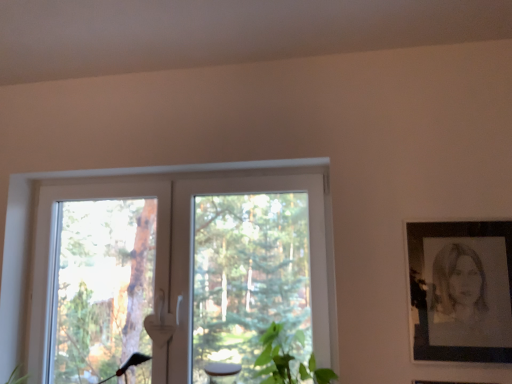
What do you see at coordinates (184, 256) in the screenshot? I see `white plastic window at center` at bounding box center [184, 256].

Image resolution: width=512 pixels, height=384 pixels. What do you see at coordinates (461, 290) in the screenshot? I see `black paper portrait at right` at bounding box center [461, 290].

Locate an element on the screen. The image size is (512, 384). white plastic window at center is located at coordinates (184, 256).

From the image's perspective, does black paper portrait at right appear lower than white plastic window at center?

No.

From a real-world perspective, is black paper portrait at right physically above white plastic window at center?

No, from a real-world perspective, black paper portrait at right is not above white plastic window at center.

Can you see black paper portrait at right touching white plastic window at center?

black paper portrait at right is not next to white plastic window at center, and they're not touching.

Relative to white plastic window at center, is black paper portrait at right in front or behind?

Visually, black paper portrait at right is located in front of white plastic window at center.

Is white plastic window at center facing towards black paper portrait at right?

No, white plastic window at center is not aimed at black paper portrait at right.

Based on their sizes in the image, would you say white plastic window at center is bigger or smaller than black paper portrait at right?

Clearly, white plastic window at center is larger in size than black paper portrait at right.

Considering the relative positions of white plastic window at center and black paper portrait at right in the image provided, is white plastic window at center to the left of black paper portrait at right from the viewer's perspective?

Correct, you'll find white plastic window at center to the left of black paper portrait at right.

Would you consider white plastic window at center to be distant from black paper portrait at right?

No, there isn't a large distance between white plastic window at center and black paper portrait at right.

From the picture: Does green leafy plant at lower center have a greater height compared to black paper portrait at right?

No, green leafy plant at lower center is not taller than black paper portrait at right.

Which is more distant, (257, 372) or (470, 315)?

The point (257, 372) is farther from the camera.

Does green leafy plant at lower center turn towards black paper portrait at right?

No, green leafy plant at lower center is not turned towards black paper portrait at right.

Is green leafy plant at lower center placed right next to black paper portrait at right?

No, green leafy plant at lower center is not beside black paper portrait at right.

Can you confirm if green leafy plant at lower center is bigger than white plastic window at center?

No.

Is point (264, 349) farther from camera compared to point (185, 316)?

No, it is not.

Are green leafy plant at lower center and white plastic window at center far apart?

They are positioned close to each other.

Could you tell me if green leafy plant at lower center is turned towards white plastic window at center?

No, green leafy plant at lower center is not aimed at white plastic window at center.

Does white plastic window at center have a smaller size compared to green leafy plant at lower center?

No, white plastic window at center is not smaller than green leafy plant at lower center.

Is white plastic window at center taller than green leafy plant at lower center?

Yes, white plastic window at center is taller than green leafy plant at lower center.

Is white plastic window at center inside the boundaries of green leafy plant at lower center, or outside?

white plastic window at center is not enclosed by green leafy plant at lower center.

You are a GUI agent. You are given a task and a screenshot of the screen. Output one action in this format:
    pyautogui.click(x=<x>, y=<y>)
    Task: Click on the plant that is under the white plastic window at center (from a real-world perspective)
    
    Given the screenshot: What is the action you would take?
    pyautogui.click(x=287, y=359)

Which is more to the left, black paper portrait at right or green leafy plant at lower center?

green leafy plant at lower center is more to the left.

From a real-world perspective, is black paper portrait at right above or below green leafy plant at lower center?

In terms of real-world spatial position, black paper portrait at right is above green leafy plant at lower center.

The width and height of the screenshot is (512, 384). In the image, there is a black paper portrait at right. In order to click on window below it (from the image's perspective) in this screenshot , I will do 184,256.

Locate an element on the screen. Image resolution: width=512 pixels, height=384 pixels. picture frame above the white plastic window at center (from the image's perspective) is located at coordinates (461, 290).

In the scene shown: When comparing their distances from green leafy plant at lower center, does black paper portrait at right or white plastic window at center seem further?

black paper portrait at right lies further to green leafy plant at lower center than the other object.

Which object lies nearer to the anchor point black paper portrait at right, white plastic window at center or green leafy plant at lower center?

Based on the image, green leafy plant at lower center appears to be nearer to black paper portrait at right.

From the image, which object appears to be farther from white plastic window at center, black paper portrait at right or green leafy plant at lower center?

Among the two, black paper portrait at right is located further to white plastic window at center.

Considering their positions, is green leafy plant at lower center positioned further to black paper portrait at right than white plastic window at center?

white plastic window at center.

Which object lies nearer to the anchor point white plastic window at center, green leafy plant at lower center or black paper portrait at right?

green leafy plant at lower center is closer to white plastic window at center.

When comparing their distances from green leafy plant at lower center, does white plastic window at center or black paper portrait at right seem closer?

white plastic window at center is positioned closer to the anchor green leafy plant at lower center.

Where is `plant located between white plastic window at center and black paper portrait at right in the left-right direction`? The height and width of the screenshot is (384, 512). plant located between white plastic window at center and black paper portrait at right in the left-right direction is located at coordinates coord(287,359).